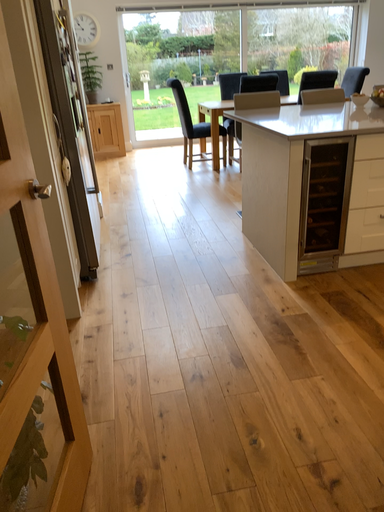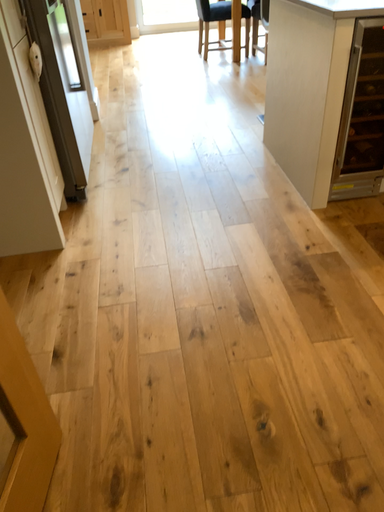
Question: How did the camera likely rotate when shooting the video?

Choices:
 (A) rotated upward
 (B) rotated downward

Answer: (B)